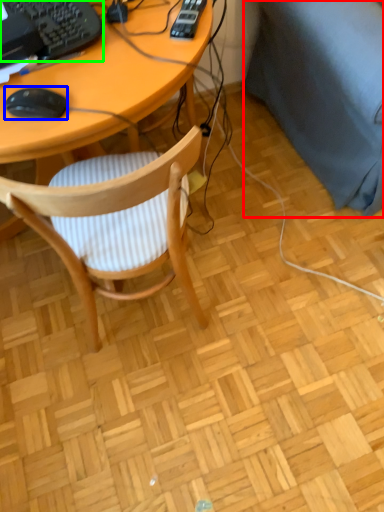
Question: Estimate the real-world distances between objects in this image. Which object is closer to couch (highlighted by a red box), mouse (highlighted by a blue box) or computer keyboard (highlighted by a green box)?

Choices:
 (A) mouse
 (B) computer keyboard

Answer: (B)